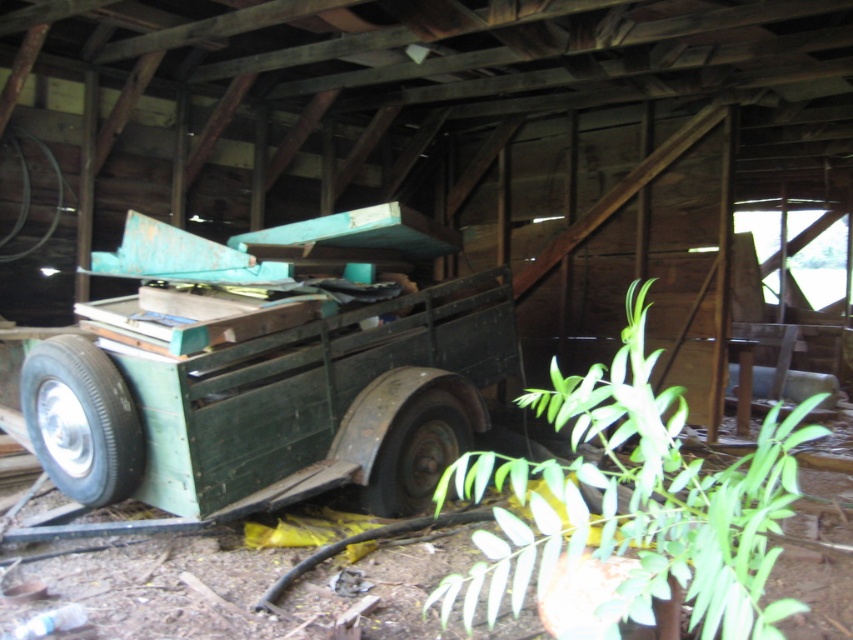
Question: Which of the following is the farthest from the observer?

Choices:
 (A) (390, 429)
 (B) (540, 467)

Answer: (B)

Question: Does black rubber tire at lower left have a smaller size compared to dark green rubber tire at center?

Choices:
 (A) yes
 (B) no

Answer: (B)

Question: Does black rubber tire at lower left have a smaller size compared to dark green rubber tire at center?

Choices:
 (A) yes
 (B) no

Answer: (B)

Question: Considering the relative positions of green leafy plant at lower right and dark green rubber tire at center in the image provided, where is green leafy plant at lower right located with respect to dark green rubber tire at center?

Choices:
 (A) left
 (B) right

Answer: (B)

Question: Which of these objects is positioned farthest from the black rubber tire at lower left?

Choices:
 (A) dark green rubber tire at center
 (B) green matte trailer at center
 (C) green leafy plant at lower right

Answer: (C)

Question: Among these points, which one is farthest from the camera?

Choices:
 (A) (440, 326)
 (B) (120, 406)
 (C) (422, 401)

Answer: (A)